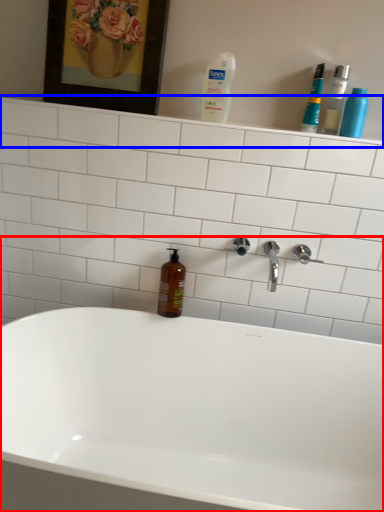
Question: Which point is closer to the camera, bathtub (highlighted by a red box) or shelve (highlighted by a blue box)?

Choices:
 (A) bathtub
 (B) shelve

Answer: (A)